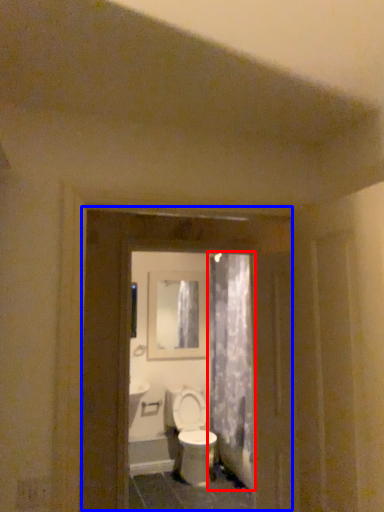
Question: Which point is further to the camera, shower curtain (highlighted by a red box) or screen door (highlighted by a blue box)?

Choices:
 (A) shower curtain
 (B) screen door

Answer: (A)